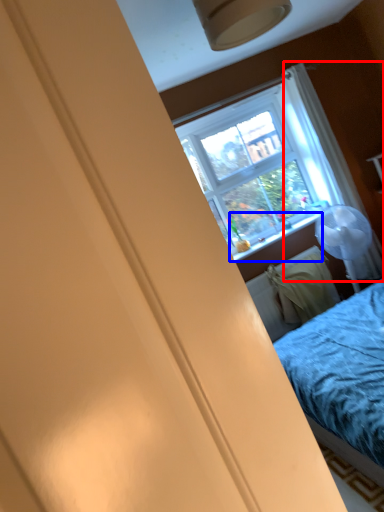
Question: Which point is closer to the camera, curtain (highlighted by a red box) or window sill (highlighted by a blue box)?

Choices:
 (A) curtain
 (B) window sill

Answer: (A)